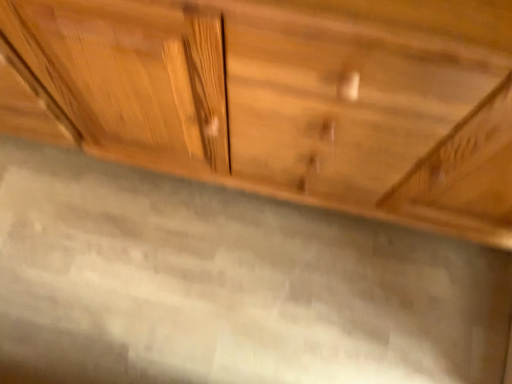
Question: Considering the relative positions of natural wood cabinet at center and gray polished granite at center in the image provided, is natural wood cabinet at center to the right of gray polished granite at center from the viewer's perspective?

Choices:
 (A) no
 (B) yes

Answer: (B)

Question: From a real-world perspective, is natural wood cabinet at center over gray polished granite at center?

Choices:
 (A) yes
 (B) no

Answer: (A)

Question: Is natural wood cabinet at center shorter than gray polished granite at center?

Choices:
 (A) yes
 (B) no

Answer: (B)

Question: Considering the relative sizes of natural wood cabinet at center and gray polished granite at center in the image provided, is natural wood cabinet at center thinner than gray polished granite at center?

Choices:
 (A) yes
 (B) no

Answer: (A)

Question: Is natural wood cabinet at center touching gray polished granite at center?

Choices:
 (A) yes
 (B) no

Answer: (B)

Question: Is natural wood cabinet at center facing towards gray polished granite at center?

Choices:
 (A) no
 (B) yes

Answer: (B)

Question: Is gray polished granite at center further to camera compared to natural wood cabinet at center?

Choices:
 (A) no
 (B) yes

Answer: (B)

Question: From a real-world perspective, is gray polished granite at center beneath natural wood cabinet at center?

Choices:
 (A) no
 (B) yes

Answer: (B)

Question: Is gray polished granite at center turned away from natural wood cabinet at center?

Choices:
 (A) no
 (B) yes

Answer: (A)

Question: Considering the relative sizes of gray polished granite at center and natural wood cabinet at center in the image provided, is gray polished granite at center taller than natural wood cabinet at center?

Choices:
 (A) no
 (B) yes

Answer: (A)

Question: Is gray polished granite at center surrounding natural wood cabinet at center?

Choices:
 (A) no
 (B) yes

Answer: (A)

Question: From a real-world perspective, is gray polished granite at center on natural wood cabinet at center?

Choices:
 (A) no
 (B) yes

Answer: (A)

Question: Choose the correct answer: Is gray polished granite at center inside natural wood cabinet at center or outside it?

Choices:
 (A) outside
 (B) inside

Answer: (A)